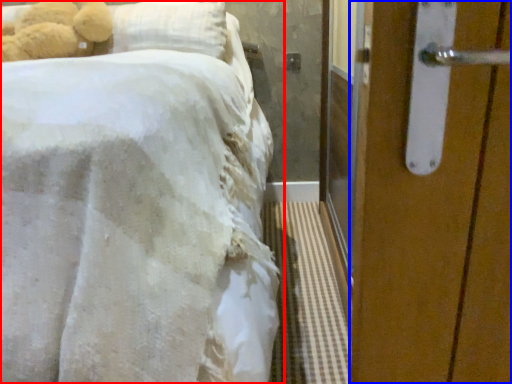
Question: Which of the following is the closest to the observer, bed (highlighted by a red box) or door (highlighted by a blue box)?

Choices:
 (A) bed
 (B) door

Answer: (A)